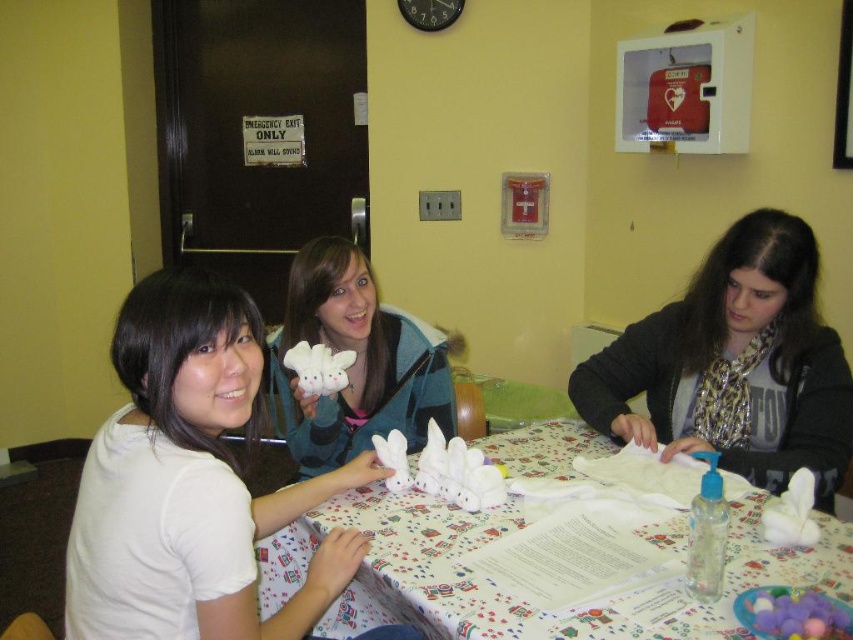
You are a person who wants to place a decorative item between the matte black scarf at center and the white paper towel at center on the table. The item you have is 12 inches long. Will it fit in the space between them?

The space between the matte black scarf at center and the white paper towel at center is 11.54 inches. Since the item is 12 inches long, it will not fit in the space between them as it is slightly longer than the available space.

You are organizing a small party and need to place a decorative item on the table. You have a white paper towel at center and a white plush toy at center. Which item occupies more horizontal space on the table?

The white paper towel at center might be wider than the white plush toy at center, so it could occupy more horizontal space on the table.